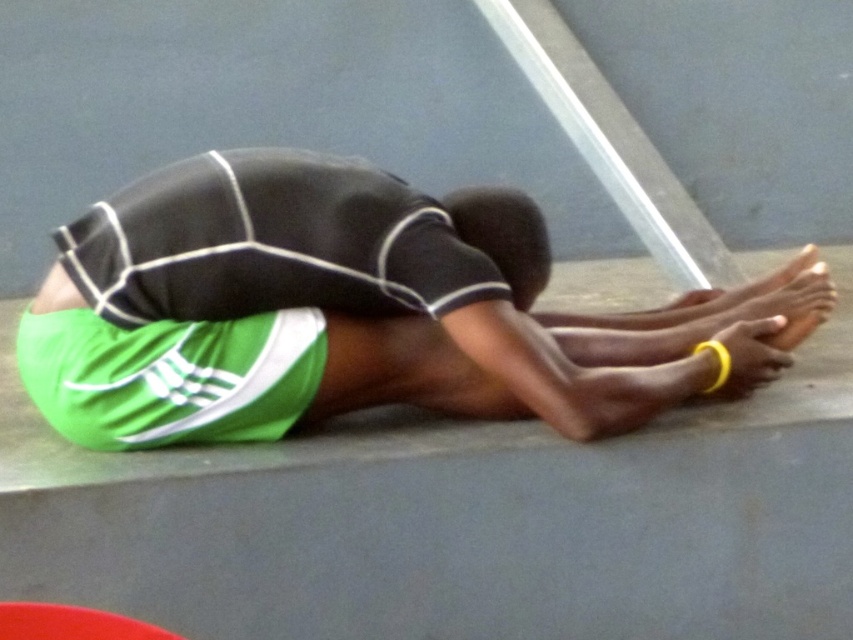
Does green fabric shorts at center appear over green fabric shorts at lower left?

Correct, green fabric shorts at center is located above green fabric shorts at lower left.

Which is in front, point (138, 376) or point (283, 342)?

Positioned in front is point (138, 376).

Which is behind, point (732, 392) or point (28, 314)?

Positioned behind is point (732, 392).

The image size is (853, 640). I want to click on green fabric shorts at center, so click(358, 310).